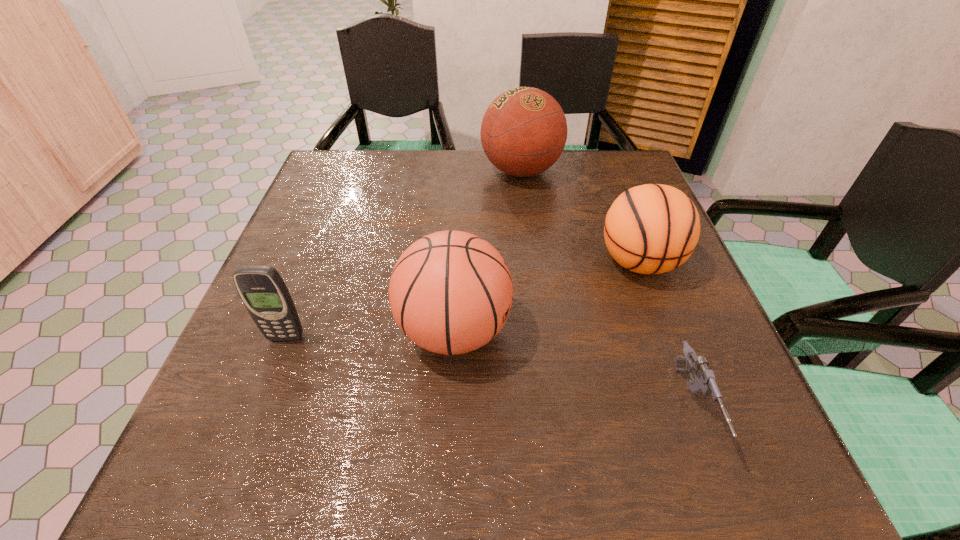
Locate an element on the screen. The image size is (960, 540). basketball that is at the right edge is located at coordinates (650, 229).

I want to click on gun situated at the right edge, so click(x=703, y=382).

I want to click on object located in the near right corner section of the desktop, so click(x=703, y=382).

Identify the location of vacant region at the far edge of the desktop. Image resolution: width=960 pixels, height=540 pixels. (459, 151).

This screenshot has height=540, width=960. In the image, there is a desktop. Identify the location of free space at the near edge. (345, 466).

In the image, there is a desktop. Identify the location of free space at the left edge. (216, 414).

In the image, there is a desktop. Where is `vacant space at the right edge`? This screenshot has width=960, height=540. vacant space at the right edge is located at coordinates (702, 302).

Where is `free space at the far left corner`? Image resolution: width=960 pixels, height=540 pixels. free space at the far left corner is located at coordinates (339, 189).

At what (x,y) coordinates should I click in order to perform the action: click on free space that is in between the shortest basketball and the shortest object. Please return your answer as a coordinate pair (x, y). Image resolution: width=960 pixels, height=540 pixels. Looking at the image, I should click on (665, 335).

You are a GUI agent. You are given a task and a screenshot of the screen. Output one action in this format:
    pyautogui.click(x=<x>, y=<y>)
    Task: Click on the free spot between the rightmost basketball and the farthest object
    
    Given the screenshot: What is the action you would take?
    pyautogui.click(x=580, y=217)